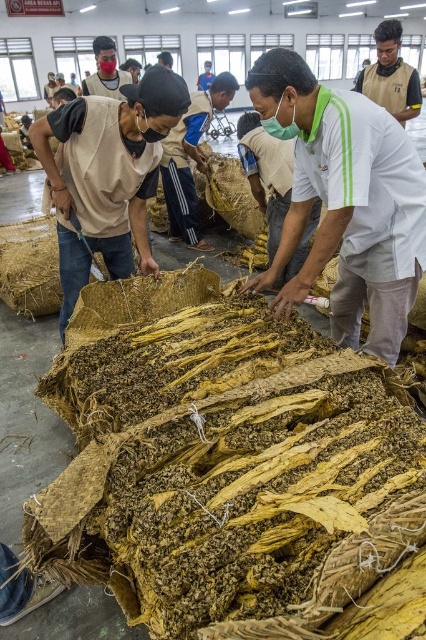
Question: Which object is farther from the camera taking this photo?

Choices:
 (A) white cotton shirt at center
 (B) matte black mask at upper center

Answer: (B)

Question: Can you confirm if matte beige shirt at center is positioned above matte black mask at upper center?

Choices:
 (A) yes
 (B) no

Answer: (B)

Question: Is beige fabric mask at left to the left of matte black mask at upper center from the viewer's perspective?

Choices:
 (A) yes
 (B) no

Answer: (B)

Question: Can you confirm if white cotton shirt at center is positioned to the left of matte black mask at upper center?

Choices:
 (A) no
 (B) yes

Answer: (A)

Question: Which object is positioned farthest from the tan fabric vest at upper right?

Choices:
 (A) white cotton shirt at center
 (B) matte beige shirt at center

Answer: (B)

Question: Which point appears closest to the camera in this image?

Choices:
 (A) coord(94,45)
 (B) coord(399,100)
 (C) coord(178,179)
 (D) coord(276,560)

Answer: (D)